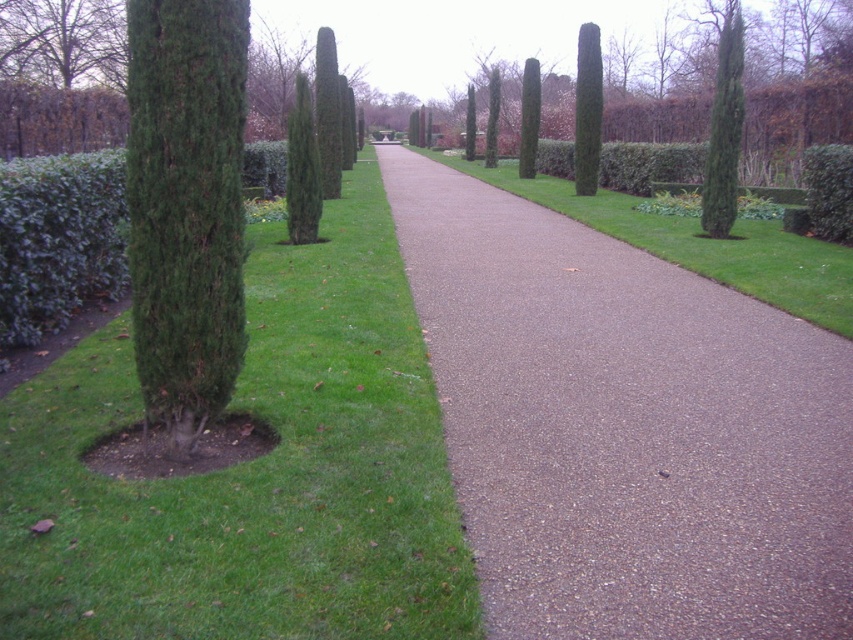
Question: Which of the following is the farthest from the observer?

Choices:
 (A) gray gravel path at center
 (B) green leafy hedge at left
 (C) green textured cypress at left

Answer: (B)

Question: Which point appears closest to the camera in this image?

Choices:
 (A) (97, 81)
 (B) (222, 3)

Answer: (B)

Question: Does green textured cypress at left come behind green matte cypress at upper right?

Choices:
 (A) yes
 (B) no

Answer: (B)

Question: Does green grass at left come behind green leafy hedge at left?

Choices:
 (A) no
 (B) yes

Answer: (A)

Question: Is green textured cypress at left smaller than green matte cypress at upper right?

Choices:
 (A) yes
 (B) no

Answer: (A)

Question: Which of the following is the closest to the observer?

Choices:
 (A) green textured cypress at left
 (B) green textured tree at upper left
 (C) gray gravel path at center

Answer: (C)